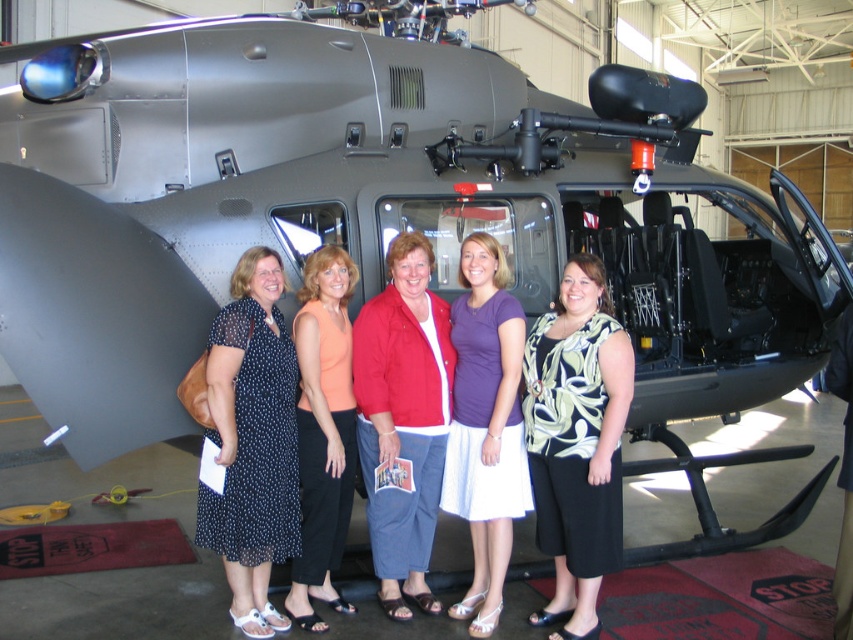
Where is `polka dot dress at center`? The height and width of the screenshot is (640, 853). polka dot dress at center is located at coordinates (252, 442).

You are a GUI agent. You are given a task and a screenshot of the screen. Output one action in this format:
    pyautogui.click(x=<x>, y=<y>)
    Task: Click on the polka dot dress at center
    The width and height of the screenshot is (853, 640).
    Given the screenshot: What is the action you would take?
    pyautogui.click(x=252, y=442)

Who is positioned more to the left, floral print blouse at center or purple cotton shirt at center?

purple cotton shirt at center is more to the left.

Is floral print blouse at center taller than purple cotton shirt at center?

No.

Locate an element on the screen. This screenshot has width=853, height=640. floral print blouse at center is located at coordinates (576, 442).

Who is positioned more to the left, polka dot dress at center or purple cotton shirt at center?

Positioned to the left is polka dot dress at center.

Can you confirm if polka dot dress at center is shorter than purple cotton shirt at center?

Correct, polka dot dress at center is not as tall as purple cotton shirt at center.

Is point (239, 614) in front of point (474, 328)?

That is True.

The width and height of the screenshot is (853, 640). I want to click on polka dot dress at center, so click(x=252, y=442).